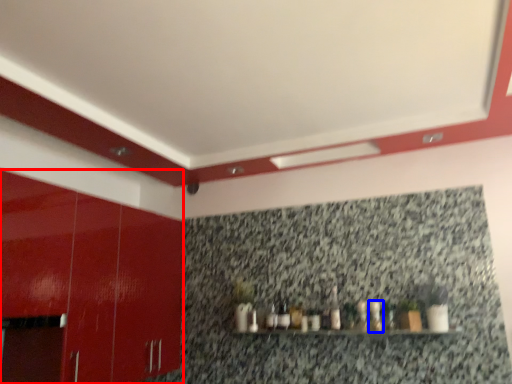
Question: Which object appears closest to the camera in this image, cabinetry (highlighted by a red box) or bottle (highlighted by a blue box)?

Choices:
 (A) cabinetry
 (B) bottle

Answer: (A)